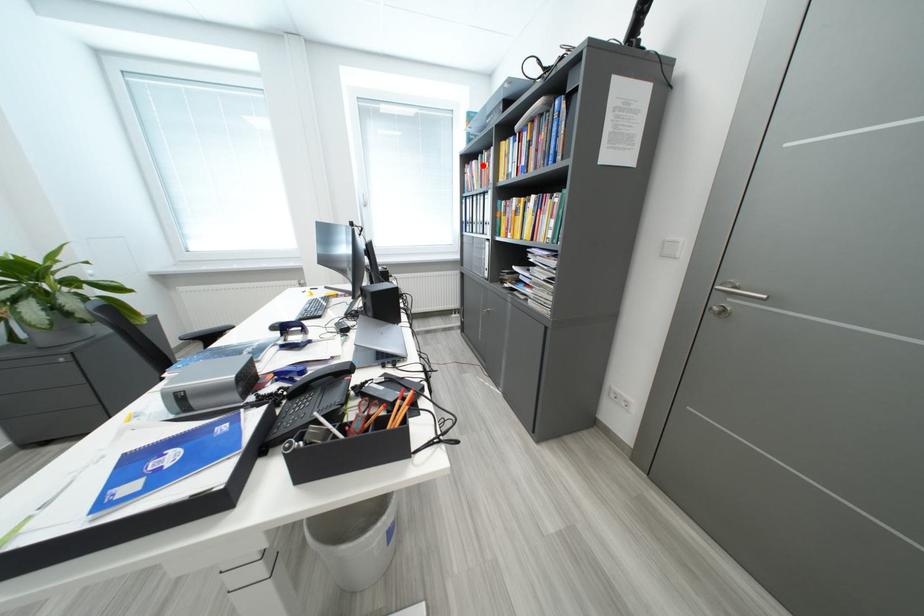
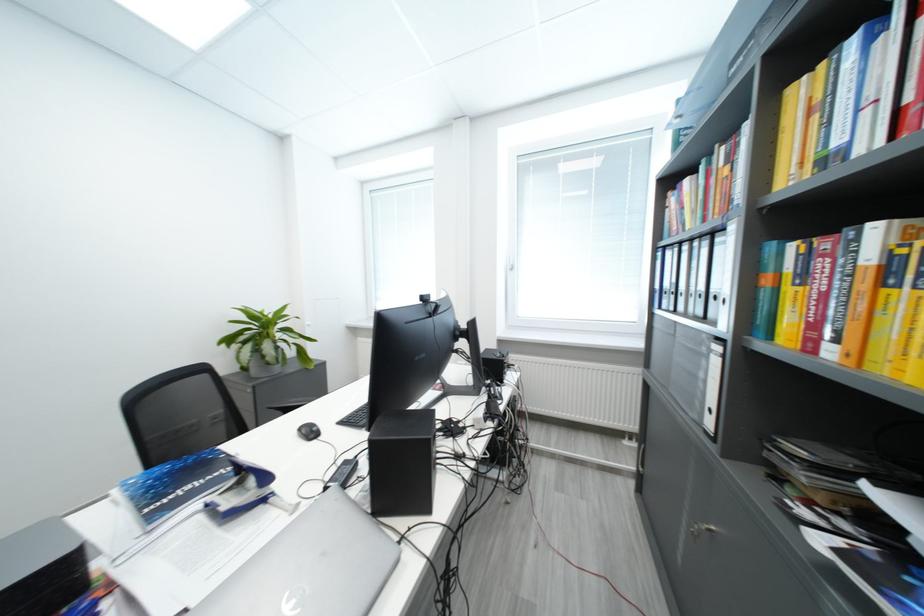
In the second image, find the point that corresponds to the highlighted location in the first image.

(696, 184)